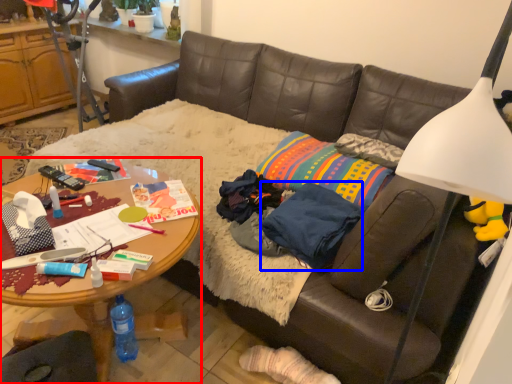
Question: Which point is further to the camera, desk (highlighted by a red box) or clothing (highlighted by a blue box)?

Choices:
 (A) desk
 (B) clothing

Answer: (B)